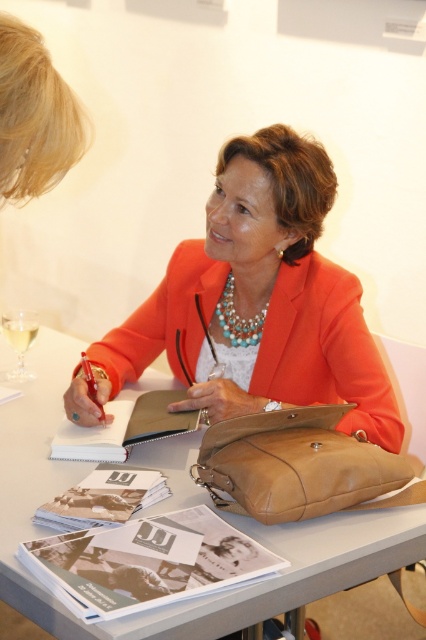
You are a photographer at a signing event. You want to take a photo of the woman with both the leather bag at center and the turquoise pearl necklace at center in the frame. Which object should you position closer to the camera to ensure both are fully visible?

The leather bag at center is taller than the turquoise pearl necklace at center. To ensure both are fully visible in the photo, position the leather bag at center closer to the camera since it is taller and requires more space in the frame.